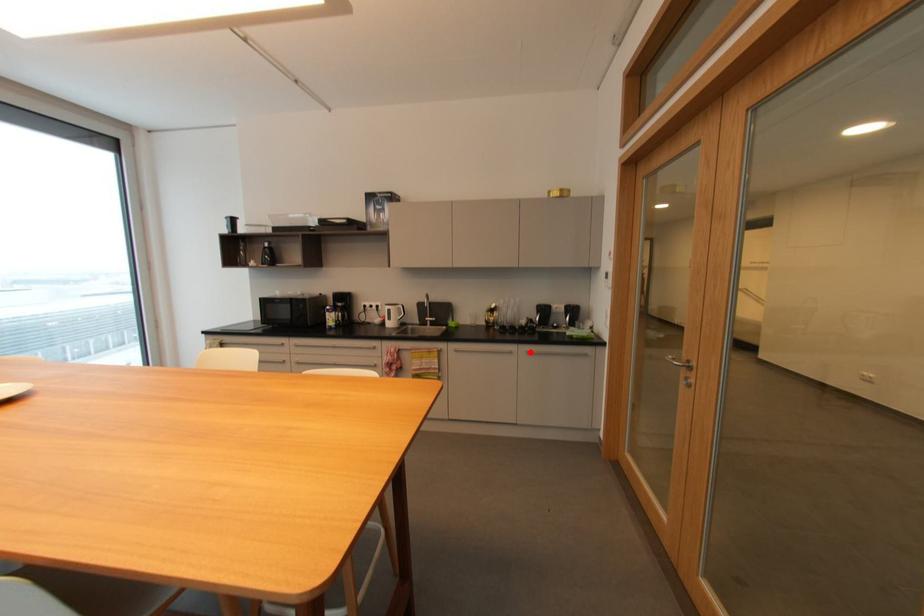
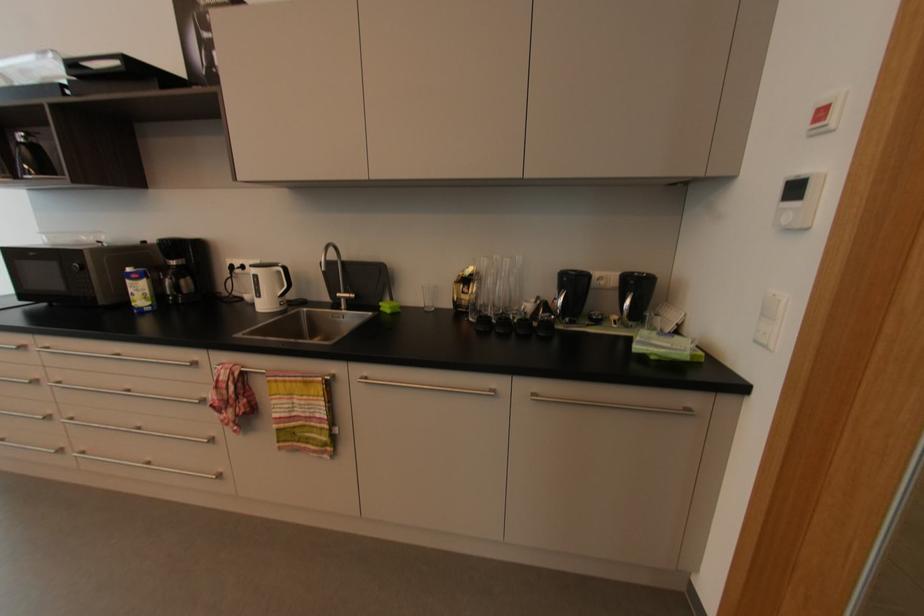
Find the pixel in the second image that matches the highlighted location in the first image.

(537, 395)